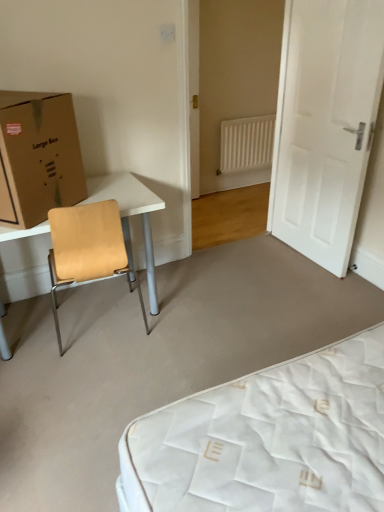
The width and height of the screenshot is (384, 512). What are the coordinates of `free spot in front of white matte door at right` in the screenshot? It's located at (299, 286).